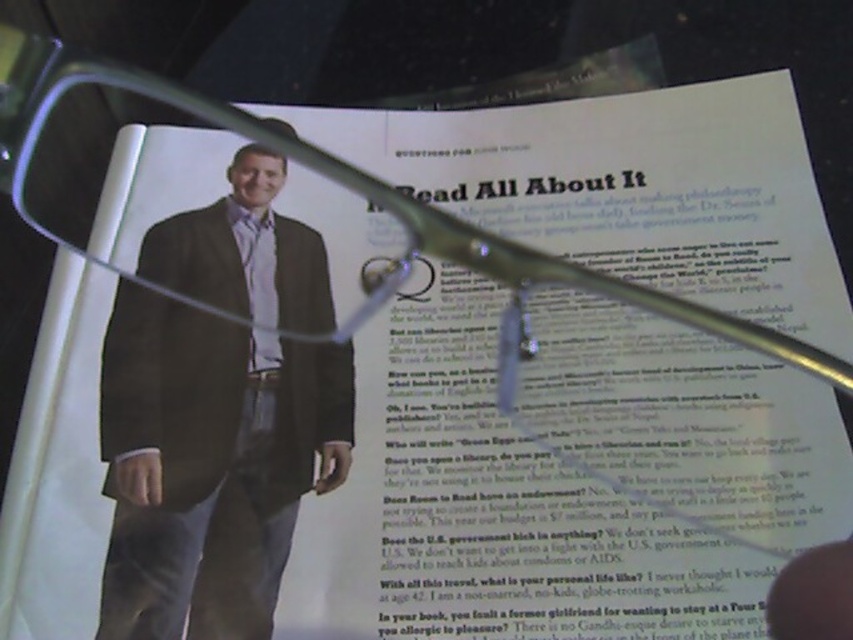
Question: Is matte brown suit at center positioned before matte black tie at center?

Choices:
 (A) yes
 (B) no

Answer: (A)

Question: Is matte brown suit at center to the right of matte black tie at center from the viewer's perspective?

Choices:
 (A) yes
 (B) no

Answer: (B)

Question: Does matte brown suit at center appear on the left side of matte black tie at center?

Choices:
 (A) yes
 (B) no

Answer: (A)

Question: Which object is farther from the camera taking this photo?

Choices:
 (A) matte brown suit at center
 (B) matte black tie at center

Answer: (B)